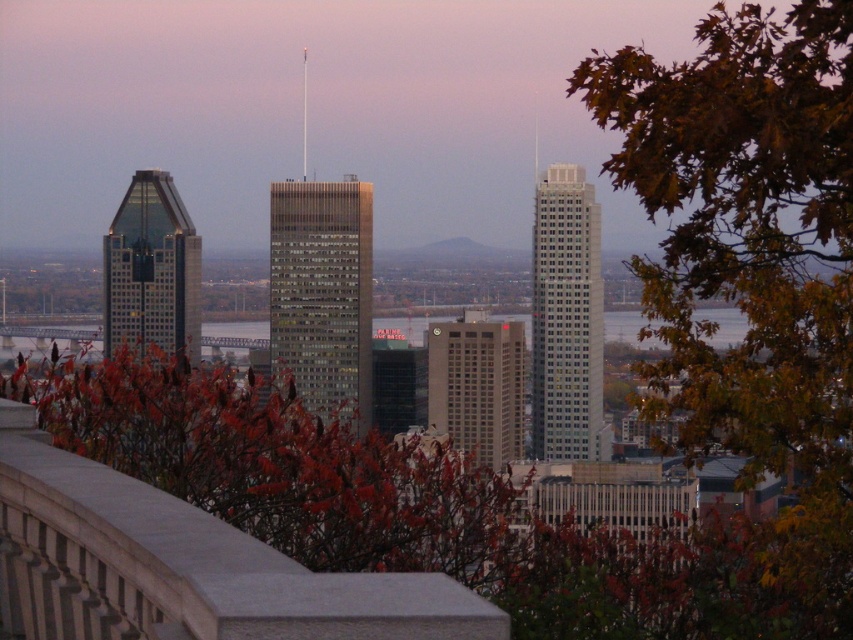
You are an urban planner reviewing this cityscape. You notice the glassy gray skyscraper at center and the beige concrete building at center. Which one appears to be taller based on their positions in the image?

The glassy gray skyscraper at center is positioned over the beige concrete building at center, indicating it is taller.

Based on the provided coordinates, which object corresponds to the point at (x=322, y=294)?

The glassy gray skyscraper at center corresponds to the point at (x=322, y=294).

You are a drone operator planning to fly a drone between the sleek silver skyscraper at center and the glassy reflective skyscraper at left. The drone has a wingspan of 1.2 meters. Can the drone safely navigate the space between them?

The distance between the sleek silver skyscraper at center and the glassy reflective skyscraper at left is 97.82 meters. Since the drone has a wingspan of 1.2 meters, there is ample space for it to fly through safely.